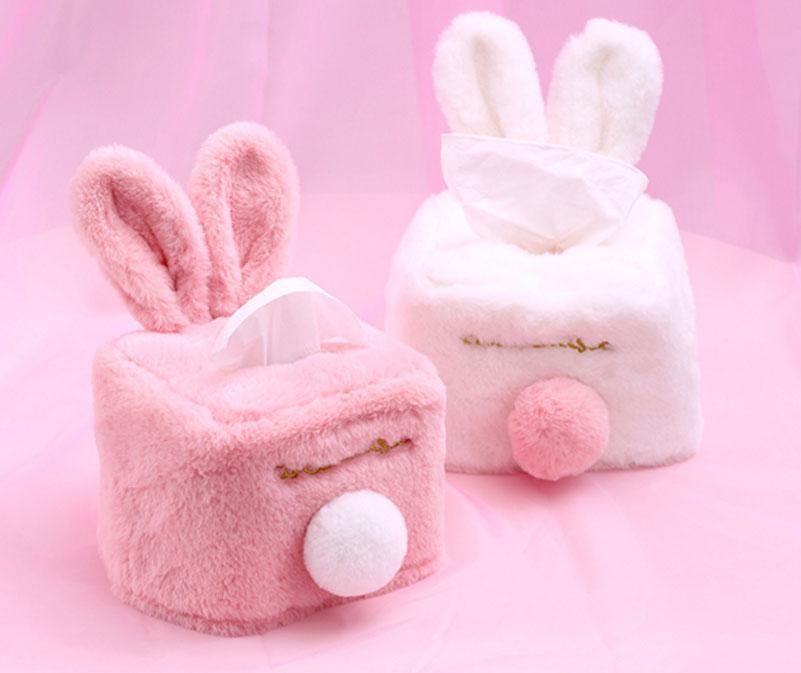
This screenshot has width=801, height=673. I want to click on pink box cover, so click(x=224, y=538).